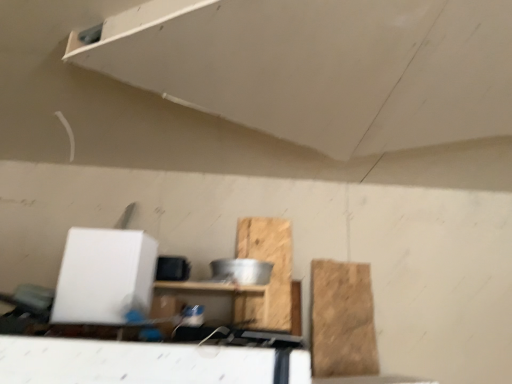
Question: Should I look upward or downward to see wooden shelf at center?

Choices:
 (A) up
 (B) down

Answer: (B)

Question: Would you say wooden at center, which is counted as the second cardboard, starting from the right, is a long distance from brown cardboard at right, which appears as the second cardboard when viewed from the left?

Choices:
 (A) no
 (B) yes

Answer: (A)

Question: Does wooden at center, which is counted as the second cardboard, starting from the right, have a lesser width compared to brown cardboard at right, which appears as the second cardboard when viewed from the left?

Choices:
 (A) no
 (B) yes

Answer: (A)

Question: From the image's perspective, is wooden at center, which is counted as the second cardboard, starting from the right, located beneath brown cardboard at right, which appears as the second cardboard when viewed from the left?

Choices:
 (A) no
 (B) yes

Answer: (A)

Question: Is wooden at center, which is counted as the second cardboard, starting from the right, closer to camera compared to brown cardboard at right, which appears as the second cardboard when viewed from the left?

Choices:
 (A) yes
 (B) no

Answer: (B)

Question: Can you confirm if wooden at center, which appears as the 1th cardboard when viewed from the left, is wider than brown cardboard at right, which is counted as the 1th cardboard, starting from the right?

Choices:
 (A) no
 (B) yes

Answer: (B)

Question: From a real-world perspective, is wooden at center, which appears as the 1th cardboard when viewed from the left, positioned over brown cardboard at right, which is counted as the 1th cardboard, starting from the right, based on gravity?

Choices:
 (A) no
 (B) yes

Answer: (B)

Question: From the image's perspective, is brown cardboard at right, which is counted as the 1th cardboard, starting from the right, under white matte exhaust hood at upper center?

Choices:
 (A) yes
 (B) no

Answer: (A)

Question: Is brown cardboard at right, which is counted as the 1th cardboard, starting from the right, facing away from white matte exhaust hood at upper center?

Choices:
 (A) no
 (B) yes

Answer: (A)

Question: From a real-world perspective, is brown cardboard at right, which appears as the second cardboard when viewed from the left, located beneath white matte exhaust hood at upper center?

Choices:
 (A) no
 (B) yes

Answer: (B)

Question: Is brown cardboard at right, which appears as the second cardboard when viewed from the left, far away from white matte exhaust hood at upper center?

Choices:
 (A) yes
 (B) no

Answer: (A)

Question: Does brown cardboard at right, which appears as the second cardboard when viewed from the left, have a smaller size compared to white matte exhaust hood at upper center?

Choices:
 (A) yes
 (B) no

Answer: (A)

Question: Does brown cardboard at right, which is counted as the 1th cardboard, starting from the right, lie in front of white matte exhaust hood at upper center?

Choices:
 (A) no
 (B) yes

Answer: (A)

Question: Is wooden shelf at center outside of brown cardboard at right, which is counted as the 1th cardboard, starting from the right?

Choices:
 (A) yes
 (B) no

Answer: (A)